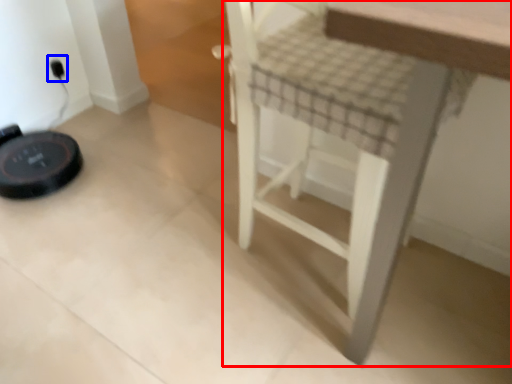
Question: Which of the following is the closest to the observer, furniture (highlighted by a red box) or electric outlet (highlighted by a blue box)?

Choices:
 (A) furniture
 (B) electric outlet

Answer: (A)